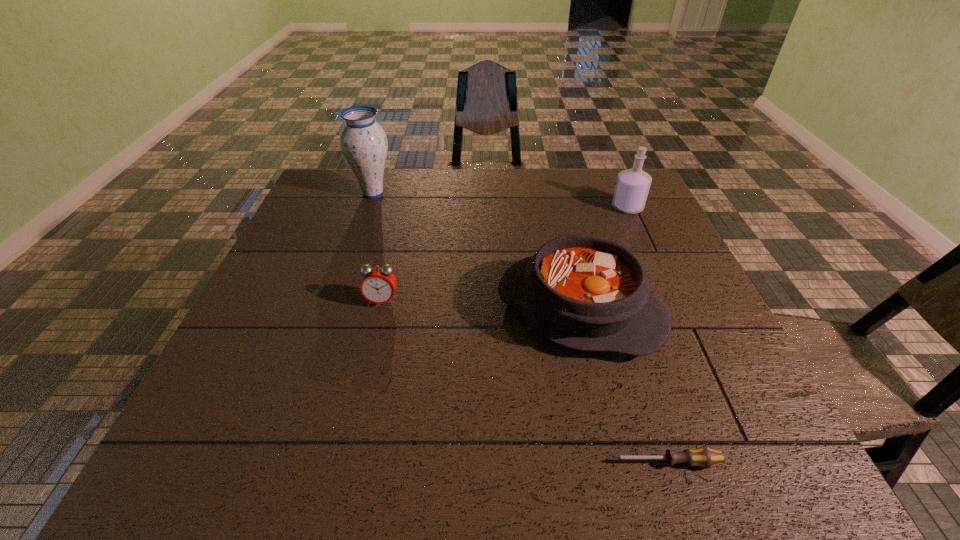
The width and height of the screenshot is (960, 540). In order to click on casserole that is positioned at the right edge in this screenshot , I will do `click(584, 292)`.

The image size is (960, 540). I want to click on screwdriver present at the right edge, so click(704, 457).

You are a GUI agent. You are given a task and a screenshot of the screen. Output one action in this format:
    pyautogui.click(x=<x>, y=<y>)
    Task: Click on the object that is at the far left corner
    
    Given the screenshot: What is the action you would take?
    coord(363,142)

The image size is (960, 540). I want to click on object that is at the far right corner, so click(x=632, y=187).

Where is `object located in the near right corner section of the desktop`? object located in the near right corner section of the desktop is located at coordinates (704, 457).

This screenshot has width=960, height=540. What are the coordinates of `vacant space at the far edge of the desktop` in the screenshot? It's located at (569, 204).

You are a GUI agent. You are given a task and a screenshot of the screen. Output one action in this format:
    pyautogui.click(x=<x>, y=<y>)
    Task: Click on the vacant space at the near edge of the desktop
    The image size is (960, 540).
    Given the screenshot: What is the action you would take?
    pyautogui.click(x=601, y=435)

Identify the location of blank space at the left edge of the desktop. (216, 378).

The width and height of the screenshot is (960, 540). In the image, there is a desktop. What are the coordinates of `vacant space at the near left corner` in the screenshot? It's located at (175, 467).

Find the location of a particular element. The width and height of the screenshot is (960, 540). free space at the far right corner of the desktop is located at coordinates (607, 202).